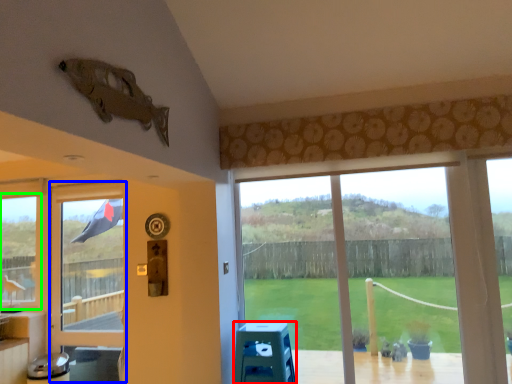
Question: Based on their relative distances, which object is nearer to stool (highlighted by a red box)? Choose from screen door (highlighted by a blue box) and window (highlighted by a green box).

Choices:
 (A) screen door
 (B) window

Answer: (A)